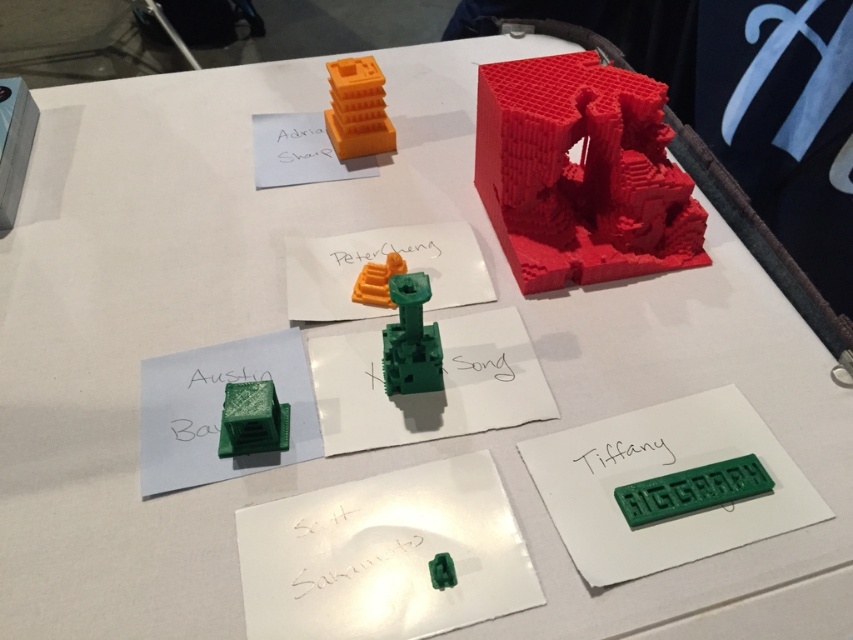
You are an art curator examining the displayed 3D printed objects. You notice the green matte tower at center and the orange matte toy at center. Based on their positions, which object is closer to the bottom edge of the table?

The green matte tower at center is below the orange matte toy at center, so it is closer to the bottom edge of the table.

You are looking at the displayed 3D printed objects on the white table. There are two points marked on the image at coordinates point (641, 179) and point (444, 572). Which point is closer to you?

Point (641, 179) is further to the camera than point (444, 572), so the point closer to you is point (444, 572).

You are organizing a display and need to place both the green matte lettering at lower right and the green matte block at lower left on a shelf. Which one should you place first if you want to use the full width of the shelf efficiently?

The green matte lettering at lower right has a larger width than the green matte block at lower left, so you should place the green matte lettering at lower right first to utilize the shelf space efficiently.